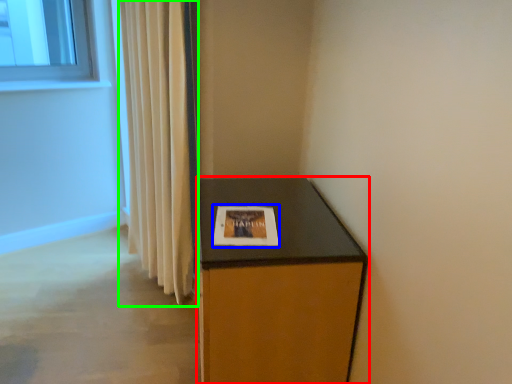
Question: Based on their relative distances, which object is nearer to furniture (highlighted by a red box)? Choose from picture frame (highlighted by a blue box) and curtain (highlighted by a green box).

Choices:
 (A) picture frame
 (B) curtain

Answer: (A)